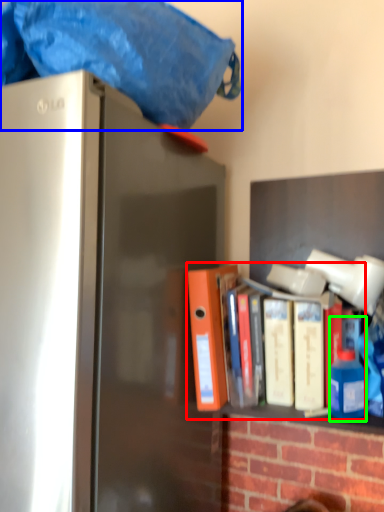
Question: Which object is the farthest from book (highlighted by a red box)? Choose among these: blanket (highlighted by a blue box) or bottle (highlighted by a green box).

Choices:
 (A) blanket
 (B) bottle

Answer: (A)